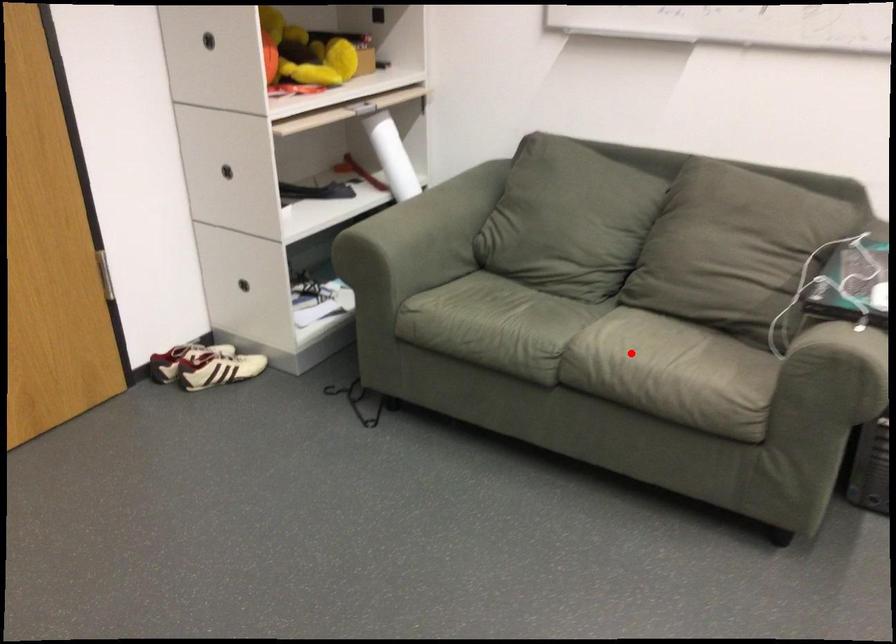
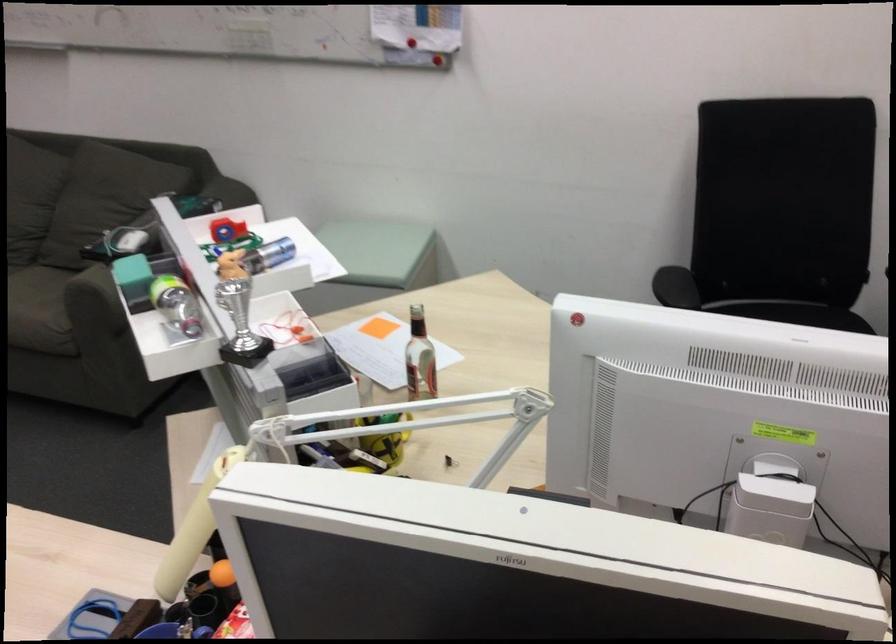
Question: I am providing you with two images of the same scene from different viewpoints. In image1, a red point is highlighted. Considering the same 3D point in image2, which of the following is correct?

Choices:
 (A) It is closer
 (B) It is farther

Answer: (B)